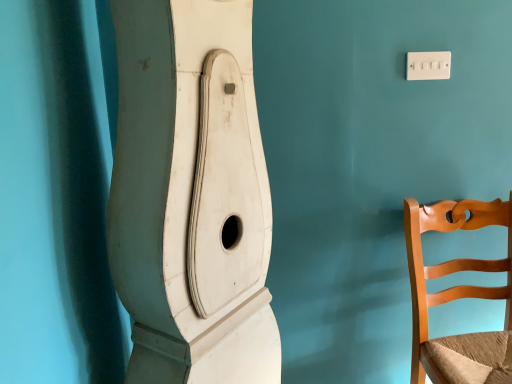
Question: Should I look upward or downward to see light brown wooden chair at right?

Choices:
 (A) down
 (B) up

Answer: (A)

Question: Is white plastic light switch at upper right next to light brown wooden chair at right and touching it?

Choices:
 (A) yes
 (B) no

Answer: (B)

Question: Can you confirm if white plastic light switch at upper right is positioned to the left of light brown wooden chair at right?

Choices:
 (A) yes
 (B) no

Answer: (A)

Question: Is white plastic light switch at upper right positioned with its back to light brown wooden chair at right?

Choices:
 (A) yes
 (B) no

Answer: (B)

Question: Is white plastic light switch at upper right outside light brown wooden chair at right?

Choices:
 (A) yes
 (B) no

Answer: (A)

Question: Can you confirm if white plastic light switch at upper right is wider than light brown wooden chair at right?

Choices:
 (A) no
 (B) yes

Answer: (A)

Question: Does white plastic light switch at upper right lie behind light brown wooden chair at right?

Choices:
 (A) yes
 (B) no

Answer: (A)

Question: From a real-world perspective, is light brown wooden chair at right positioned under white plastic light switch at upper right based on gravity?

Choices:
 (A) yes
 (B) no

Answer: (A)

Question: From a real-world perspective, is light brown wooden chair at right located higher than white plastic light switch at upper right?

Choices:
 (A) no
 (B) yes

Answer: (A)

Question: Does light brown wooden chair at right have a lesser width compared to white plastic light switch at upper right?

Choices:
 (A) yes
 (B) no

Answer: (B)

Question: Is light brown wooden chair at right closer to camera compared to white plastic light switch at upper right?

Choices:
 (A) yes
 (B) no

Answer: (A)

Question: Is light brown wooden chair at right surrounding white plastic light switch at upper right?

Choices:
 (A) yes
 (B) no

Answer: (B)

Question: Can you confirm if light brown wooden chair at right is bigger than white plastic light switch at upper right?

Choices:
 (A) no
 (B) yes

Answer: (B)

Question: Looking at the image, does white plastic light switch at upper right seem bigger or smaller compared to light brown wooden chair at right?

Choices:
 (A) small
 (B) big

Answer: (A)